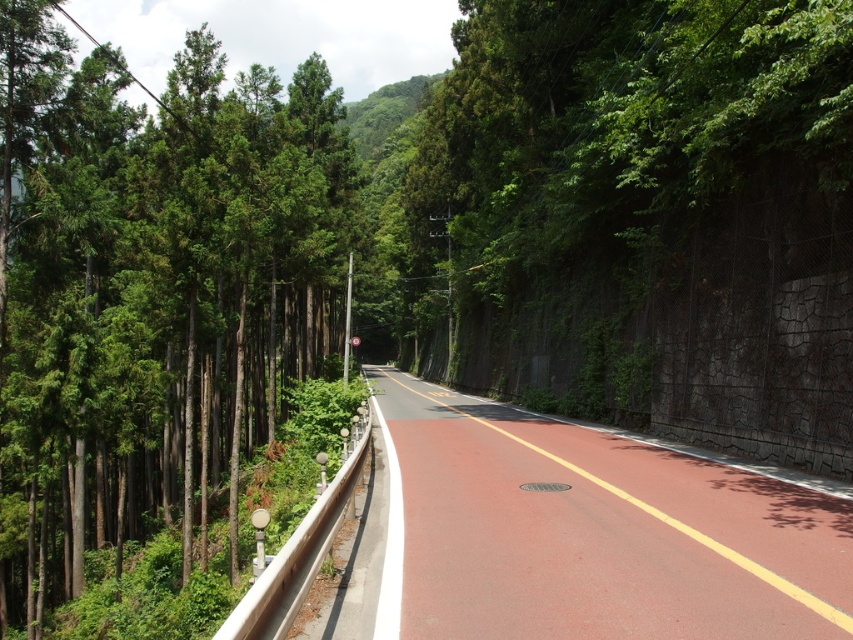
Question: Is green textured trees at left positioned at the back of smooth asphalt road at center?

Choices:
 (A) no
 (B) yes

Answer: (B)

Question: Which object appears closest to the camera in this image?

Choices:
 (A) green textured trees at left
 (B) smooth asphalt road at center

Answer: (B)

Question: Which point is farther to the camera?

Choices:
 (A) (70, 100)
 (B) (827, 500)

Answer: (A)

Question: Does green textured trees at left have a lesser width compared to smooth asphalt road at center?

Choices:
 (A) no
 (B) yes

Answer: (A)

Question: Does green textured trees at left have a greater width compared to smooth asphalt road at center?

Choices:
 (A) yes
 (B) no

Answer: (A)